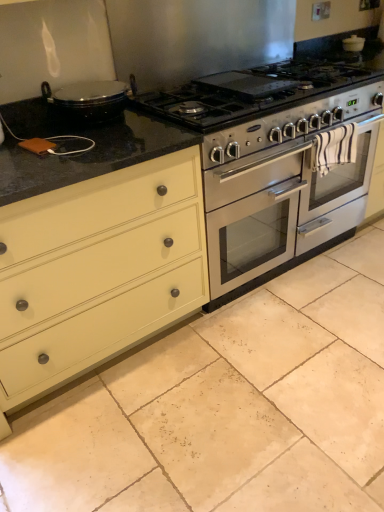
I want to click on vacant space situated above beige matte tile at center (from a real-world perspective), so click(x=244, y=377).